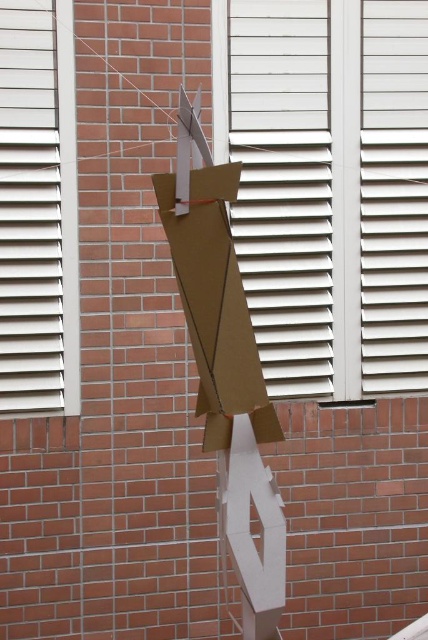
In the scene shown: Is white textured window at center taller than brown cardboard at center?

Yes, white textured window at center is taller than brown cardboard at center.

Does point (353, 22) come closer to viewer compared to point (228, 168)?

That is False.

Locate an element on the screen. The height and width of the screenshot is (640, 428). white textured window at center is located at coordinates (329, 186).

Does white matte window at center have a larger size compared to brown cardboard at center?

Incorrect, white matte window at center is not larger than brown cardboard at center.

Can you confirm if white matte window at center is positioned to the left of brown cardboard at center?

Yes, white matte window at center is to the left of brown cardboard at center.

Does point (35, 381) lie behind point (252, 388)?

Yes, point (35, 381) is farther from viewer.

Find the location of `white matte window at center`. white matte window at center is located at coordinates (38, 209).

Is white textured window at center closer to the viewer compared to white matte window at center?

No, it is behind white matte window at center.

Does white textured window at center have a greater width compared to white matte window at center?

Yes.

Does point (386, 88) lie in front of point (2, 371)?

No, it is not.

You are a GUI agent. You are given a task and a screenshot of the screen. Output one action in this format:
    pyautogui.click(x=<x>, y=<y>)
    Task: Click on the white textured window at center
    Image resolution: width=428 pixels, height=640 pixels.
    Given the screenshot: What is the action you would take?
    pyautogui.click(x=329, y=186)